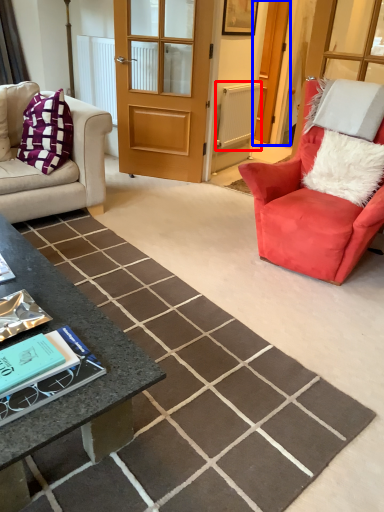
Question: Among these objects, which one is nearest to the camera, radiator (highlighted by a red box) or screen door (highlighted by a blue box)?

Choices:
 (A) radiator
 (B) screen door

Answer: (A)